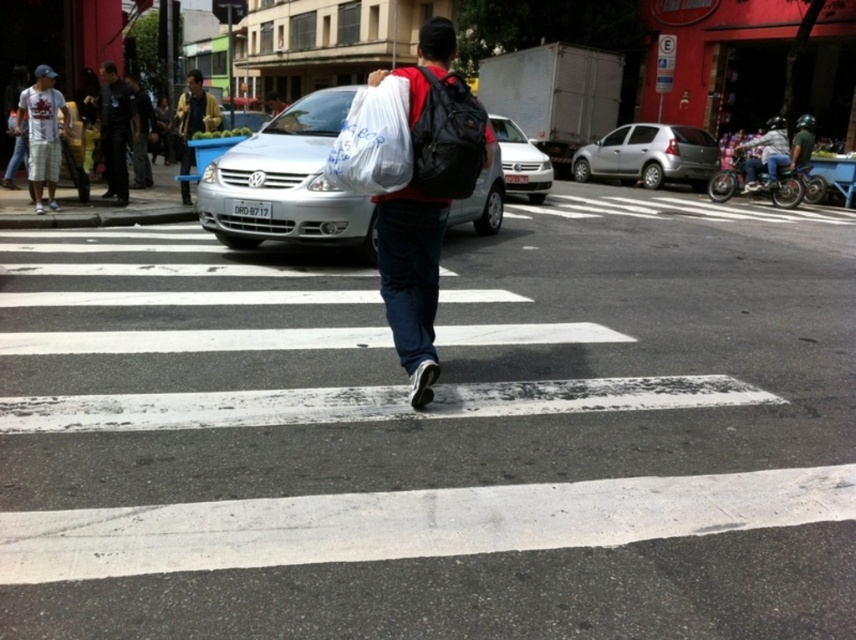
Is matte black backpack at center positioned before white matte car at center?

That is True.

Which is more to the left, matte black backpack at center or white matte car at center?

matte black backpack at center

Between point (434, 365) and point (525, 177), which one is positioned in front?

Positioned in front is point (434, 365).

You are a GUI agent. You are given a task and a screenshot of the screen. Output one action in this format:
    pyautogui.click(x=<x>, y=<y>)
    Task: Click on the matte black backpack at center
    
    Given the screenshot: What is the action you would take?
    pyautogui.click(x=426, y=196)

Describe the element at coordinates (194, 116) in the screenshot. I see `yellow fabric bag at upper left` at that location.

Who is shorter, yellow fabric bag at upper left or metallic silver helmet at upper right?

metallic silver helmet at upper right is shorter.

Is point (185, 164) farther from camera compared to point (779, 154)?

No.

This screenshot has height=640, width=856. In order to click on yellow fabric bag at upper left in this screenshot , I will do `click(194, 116)`.

Does matte black backpack at center lie behind metallic silver helmet at upper right?

No, matte black backpack at center is closer to the viewer.

Is matte black backpack at center to the left of metallic silver helmet at upper right from the viewer's perspective?

Indeed, matte black backpack at center is positioned on the left side of metallic silver helmet at upper right.

This screenshot has height=640, width=856. What do you see at coordinates (426, 196) in the screenshot?
I see `matte black backpack at center` at bounding box center [426, 196].

This screenshot has height=640, width=856. Identify the location of matte black backpack at center. (426, 196).